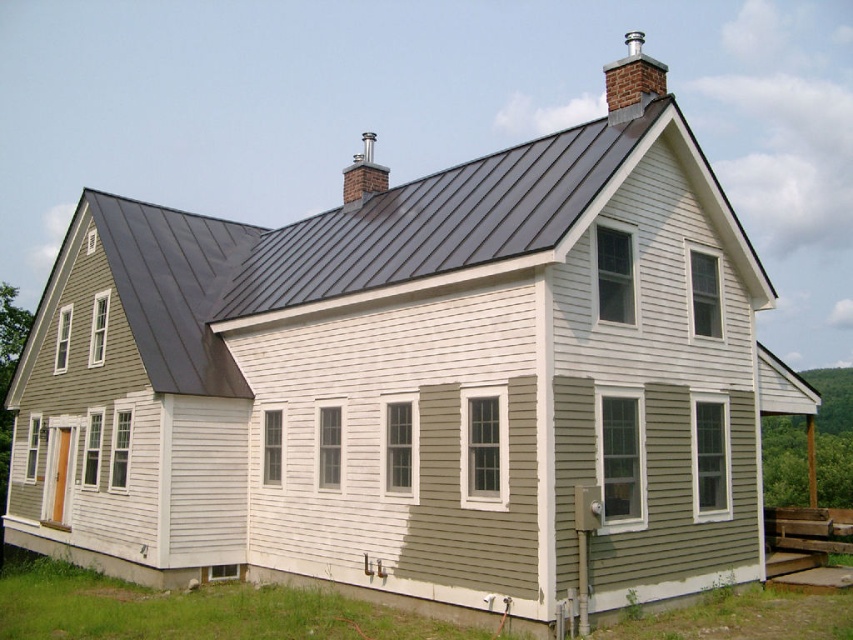
Find the location of a particular element. The width and height of the screenshot is (853, 640). silver metallic chimney at upper right is located at coordinates (631, 81).

Identify the location of silver metallic chimney at upper right. Image resolution: width=853 pixels, height=640 pixels. click(x=631, y=81).